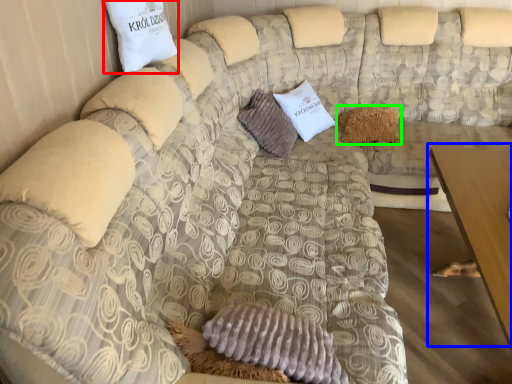
Question: Which object is the farthest from pillow (highlighted by a red box)? Choose among these: table (highlighted by a blue box) or pillow (highlighted by a green box).

Choices:
 (A) table
 (B) pillow

Answer: (B)